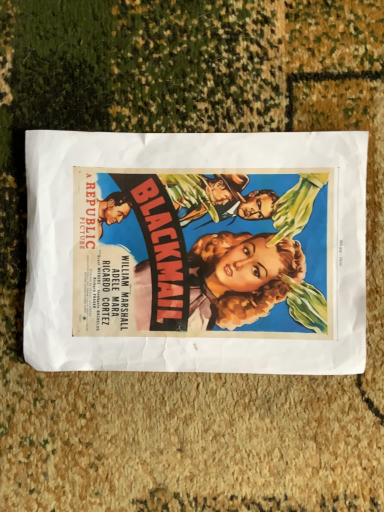
Where is `matte paper poster at center`? matte paper poster at center is located at coordinates (196, 252).

What do you see at coordinates (196, 252) in the screenshot? I see `matte paper poster at center` at bounding box center [196, 252].

Image resolution: width=384 pixels, height=512 pixels. I want to click on matte paper poster at center, so click(x=196, y=252).